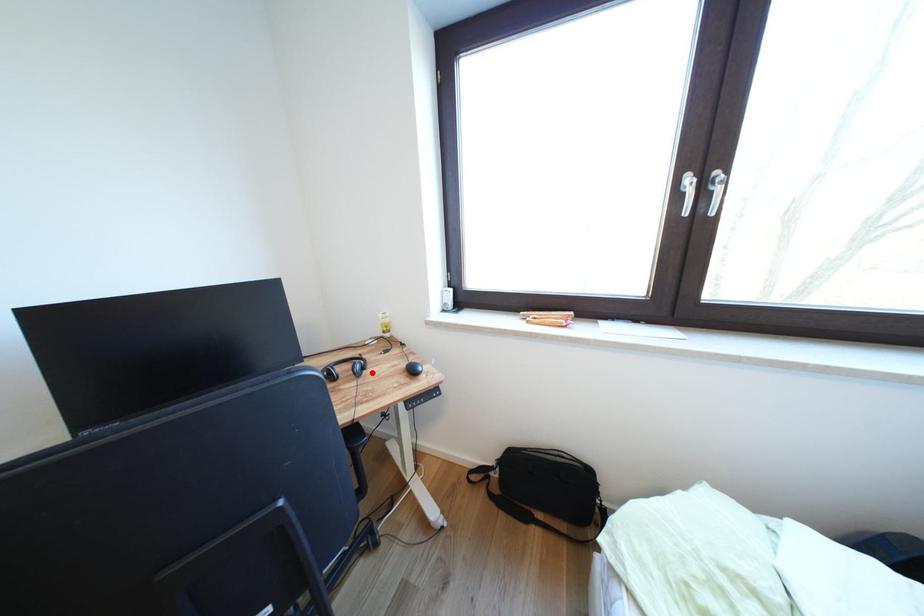
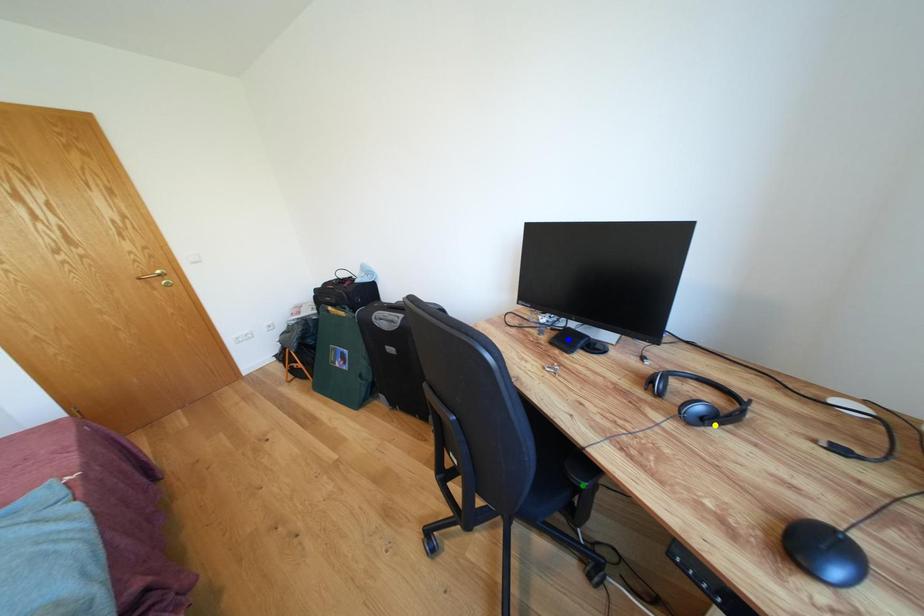
Question: I am providing you with two images of the same scene from different viewpoints. A red point is marked on the first image. You are given multiple points on the second image. Which point in image 2 represents the same 3d spot as the red point in image 1?

Choices:
 (A) green point
 (B) yellow point
 (C) blue point

Answer: (B)